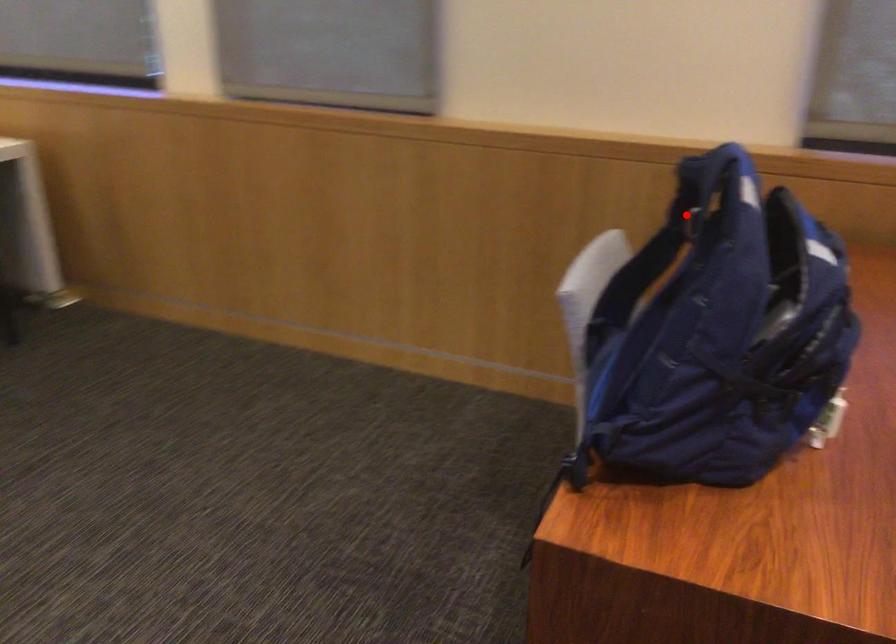
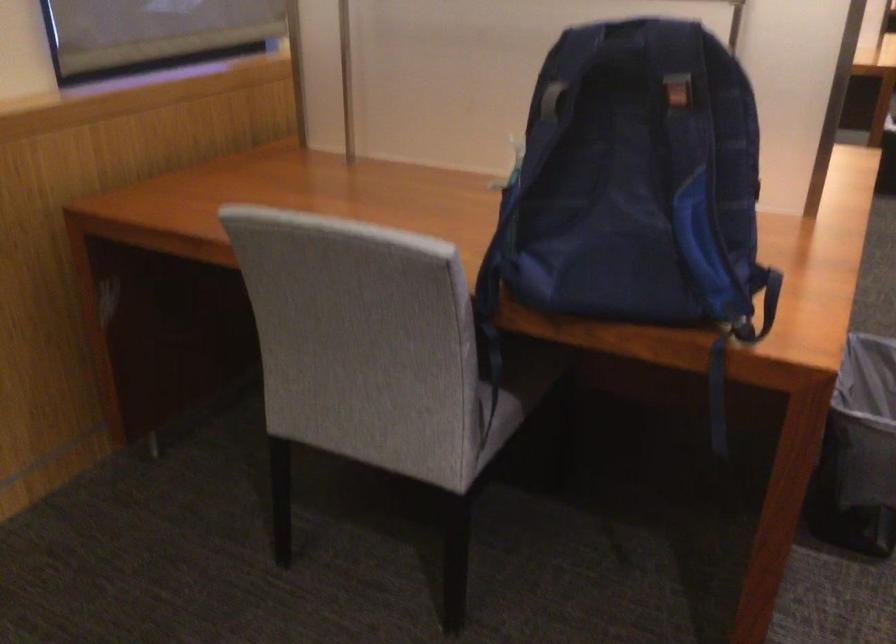
Locate, in the second image, the point that corresponds to the highlighted location in the first image.

(552, 100)